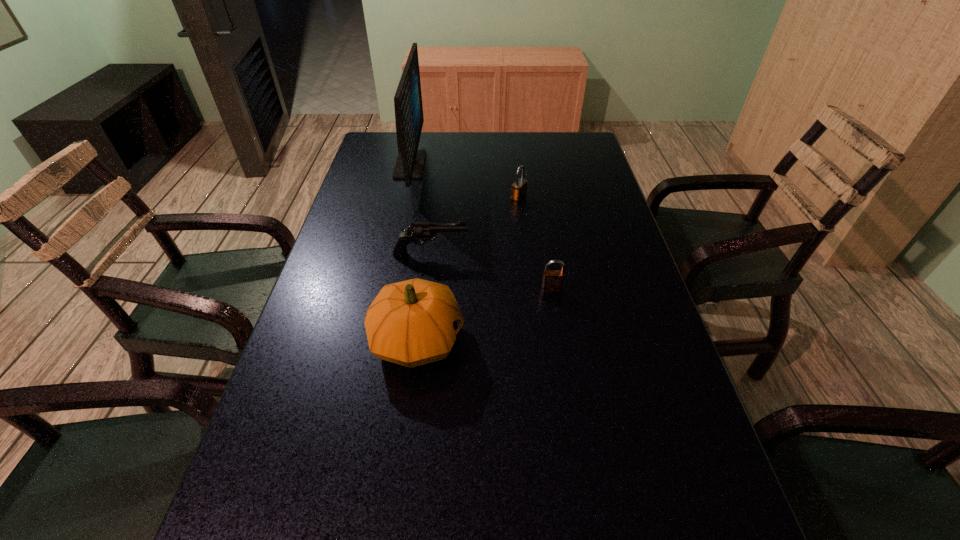
In the image, there is a desktop. Identify the location of vacant space at the far left corner. The height and width of the screenshot is (540, 960). (390, 132).

Find the location of `free location at the far right corner`. free location at the far right corner is located at coordinates (550, 160).

In order to click on vacant space that is in between the tallest object and the nearer padlock in this screenshot , I will do `click(481, 227)`.

The width and height of the screenshot is (960, 540). Find the location of `free space between the left padlock and the tallest object`. free space between the left padlock and the tallest object is located at coordinates (465, 181).

The image size is (960, 540). Find the location of `vacant space in between the nearer padlock and the left padlock`. vacant space in between the nearer padlock and the left padlock is located at coordinates (535, 243).

Where is `free spot between the gun and the computer monitor`? This screenshot has width=960, height=540. free spot between the gun and the computer monitor is located at coordinates (420, 210).

You are a GUI agent. You are given a task and a screenshot of the screen. Output one action in this format:
    pyautogui.click(x=<x>, y=<y>)
    Task: Click on the vacant space that is in between the fourth object from left to right and the computer monitor
    This screenshot has height=540, width=960.
    Given the screenshot: What is the action you would take?
    pyautogui.click(x=465, y=181)

In order to click on free space between the third nearest object and the farther padlock in this screenshot , I will do `click(475, 226)`.

The image size is (960, 540). In order to click on empty space that is in between the gourd and the farther padlock in this screenshot , I will do `click(468, 268)`.

Locate an element on the screen. The image size is (960, 540). object that is the fourth closest to the right padlock is located at coordinates (409, 119).